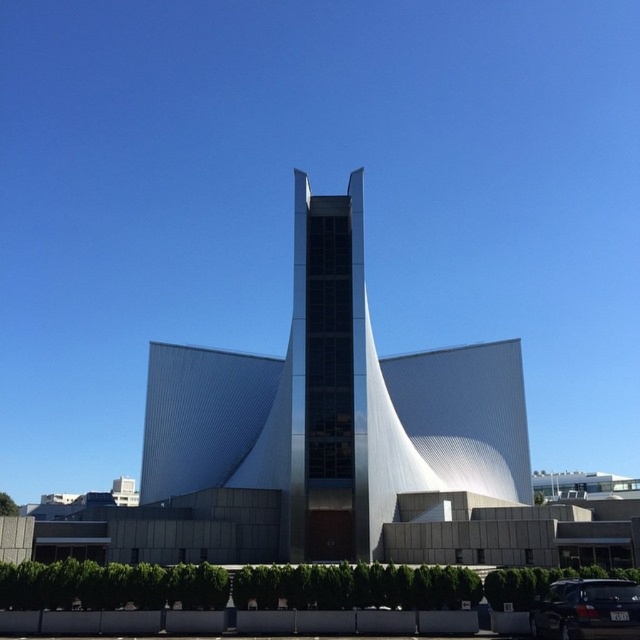
Does smooth glass tower at center come in front of dark gray metallic car at lower right?

No, it is not.

Does smooth glass tower at center appear on the right side of dark gray metallic car at lower right?

No, smooth glass tower at center is not to the right of dark gray metallic car at lower right.

Which is in front, point (342, 403) or point (621, 627)?

Point (621, 627)

The height and width of the screenshot is (640, 640). Identify the location of smooth glass tower at center. (328, 378).

Can you confirm if metallic silver tower at center is positioned above dark gray metallic car at lower right?

Correct, metallic silver tower at center is located above dark gray metallic car at lower right.

The image size is (640, 640). What do you see at coordinates (333, 406) in the screenshot?
I see `metallic silver tower at center` at bounding box center [333, 406].

Identify the location of metallic silver tower at center. The height and width of the screenshot is (640, 640). (333, 406).

Image resolution: width=640 pixels, height=640 pixels. Describe the element at coordinates (333, 406) in the screenshot. I see `metallic silver tower at center` at that location.

Who is more distant from viewer, (403, 435) or (348, 458)?

The point (403, 435) is more distant.

Is point (300, 348) closer to viewer compared to point (349, 420)?

No, it is not.

Locate an element on the screen. This screenshot has height=640, width=640. metallic silver tower at center is located at coordinates (333, 406).